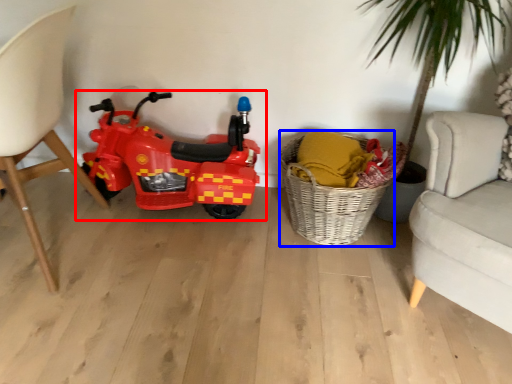
Question: Among these objects, which one is nearest to the camera, land vehicle (highlighted by a red box) or basket (highlighted by a blue box)?

Choices:
 (A) land vehicle
 (B) basket

Answer: (B)